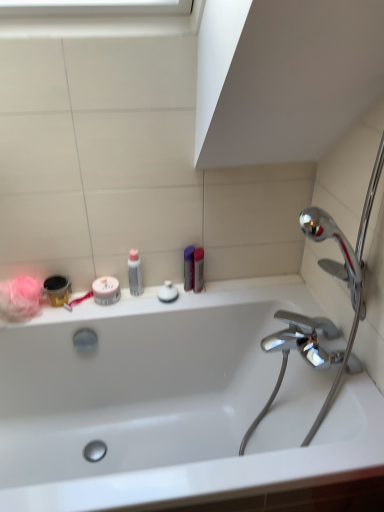
Locate an element on the screen. The image size is (384, 512). white matte jar at center, marked as the first mouthwash in a left-to-right arrangement is located at coordinates (106, 290).

I want to click on metallic silver mouthwash at right, acting as the 2th mouthwash starting from the left, so click(x=198, y=269).

This screenshot has width=384, height=512. What do you see at coordinates (198, 269) in the screenshot?
I see `metallic silver mouthwash at right, marked as the first mouthwash in a right-to-left arrangement` at bounding box center [198, 269].

The image size is (384, 512). Find the location of `white glossy soap at center, placed as the 2th toiletry when sorted from left to right`. white glossy soap at center, placed as the 2th toiletry when sorted from left to right is located at coordinates (168, 292).

Locate an element on the screen. This screenshot has width=384, height=512. white glossy bathtub at center is located at coordinates (172, 403).

Can you confirm if white glossy bathtub at center is bigger than translucent plastic bottle at upper center, which appears as the 3th toiletry when viewed from the right?

Yes.

Is white glossy bathtub at center to the right of translucent plastic bottle at upper center, which appears as the 3th toiletry when viewed from the right, from the viewer's perspective?

Yes.

Is white glossy bathtub at center further to the viewer compared to translucent plastic bottle at upper center, the 1th toiletry positioned from the left?

No, white glossy bathtub at center is in front of translucent plastic bottle at upper center, the 1th toiletry positioned from the left.

Where is `the 2nd toiletry counting from the right side of the white glossy bathtub at center`? The image size is (384, 512). the 2nd toiletry counting from the right side of the white glossy bathtub at center is located at coordinates (189, 268).

Would you say purple plastic container at upper center, which appears as the 1th toiletry when viewed from the right, is outside white glossy bathtub at center?

Yes.

Is purple plastic container at upper center, which appears as the third toiletry when viewed from the left, smaller than white glossy bathtub at center?

Correct, purple plastic container at upper center, which appears as the third toiletry when viewed from the left, occupies less space than white glossy bathtub at center.

How distant is purple plastic container at upper center, which appears as the 1th toiletry when viewed from the right, from white glossy bathtub at center?

purple plastic container at upper center, which appears as the 1th toiletry when viewed from the right, and white glossy bathtub at center are 19.05 inches apart.

Is white matte jar at center, which ranks as the 2th mouthwash in right-to-left order, positioned beyond the bounds of white glossy soap at center, placed as the 2th toiletry when sorted from left to right?

Absolutely, white matte jar at center, which ranks as the 2th mouthwash in right-to-left order, is external to white glossy soap at center, placed as the 2th toiletry when sorted from left to right.

From a real-world perspective, does white matte jar at center, which ranks as the 2th mouthwash in right-to-left order, sit lower than white glossy soap at center, the second toiletry positioned from the right?

No, from a real-world perspective, white matte jar at center, which ranks as the 2th mouthwash in right-to-left order, is not beneath white glossy soap at center, the second toiletry positioned from the right.

Which object is positioned more to the left, white matte jar at center, marked as the first mouthwash in a left-to-right arrangement, or white glossy soap at center, placed as the 2th toiletry when sorted from left to right?

Positioned to the left is white matte jar at center, marked as the first mouthwash in a left-to-right arrangement.

Considering the relative sizes of translucent plastic bottle at upper center, which appears as the 3th toiletry when viewed from the right, and purple plastic container at upper center, which appears as the third toiletry when viewed from the left, in the image provided, is translucent plastic bottle at upper center, which appears as the 3th toiletry when viewed from the right, shorter than purple plastic container at upper center, which appears as the third toiletry when viewed from the left,?

Incorrect, the height of translucent plastic bottle at upper center, which appears as the 3th toiletry when viewed from the right, does not fall short of that of purple plastic container at upper center, which appears as the third toiletry when viewed from the left.

Measure the distance from translucent plastic bottle at upper center, the 1th toiletry positioned from the left, to purple plastic container at upper center, which appears as the third toiletry when viewed from the left.

translucent plastic bottle at upper center, the 1th toiletry positioned from the left, and purple plastic container at upper center, which appears as the third toiletry when viewed from the left, are 7.22 inches apart.

Would you say translucent plastic bottle at upper center, which appears as the 3th toiletry when viewed from the right, is outside purple plastic container at upper center, which appears as the 1th toiletry when viewed from the right?

Yes, translucent plastic bottle at upper center, which appears as the 3th toiletry when viewed from the right, is located beyond the bounds of purple plastic container at upper center, which appears as the 1th toiletry when viewed from the right.

Is translucent plastic bottle at upper center, which appears as the 3th toiletry when viewed from the right, aimed at purple plastic container at upper center, which appears as the 1th toiletry when viewed from the right?

No, translucent plastic bottle at upper center, which appears as the 3th toiletry when viewed from the right, is not facing towards purple plastic container at upper center, which appears as the 1th toiletry when viewed from the right.

Which of these two, metallic silver toothbrush at left or white glossy bathtub at center, is smaller?

metallic silver toothbrush at left is smaller.

Is metallic silver toothbrush at left not near white glossy bathtub at center?

No, there isn't a large distance between metallic silver toothbrush at left and white glossy bathtub at center.

From a real-world perspective, is metallic silver toothbrush at left below white glossy bathtub at center?

No.

The width and height of the screenshot is (384, 512). Identify the location of bathtub to the right of metallic silver toothbrush at left. (172, 403).

Are white matte jar at center, which ranks as the 2th mouthwash in right-to-left order, and white glossy bathtub at center far apart?

They are positioned close to each other.

Considering the positions of objects white matte jar at center, marked as the first mouthwash in a left-to-right arrangement, and white glossy bathtub at center in the image provided, who is more to the right, white matte jar at center, marked as the first mouthwash in a left-to-right arrangement, or white glossy bathtub at center?

white glossy bathtub at center is more to the right.

This screenshot has height=512, width=384. Find the location of `mouthwash that is the 1st one above the white glossy bathtub at center (from a real-world perspective)`. mouthwash that is the 1st one above the white glossy bathtub at center (from a real-world perspective) is located at coordinates (106, 290).

Considering the sizes of white matte jar at center, marked as the first mouthwash in a left-to-right arrangement, and white glossy bathtub at center in the image, is white matte jar at center, marked as the first mouthwash in a left-to-right arrangement, bigger or smaller than white glossy bathtub at center?

Clearly, white matte jar at center, marked as the first mouthwash in a left-to-right arrangement, is smaller in size than white glossy bathtub at center.

Which object is positioned more to the right, metallic silver mouthwash at right, acting as the 2th mouthwash starting from the left, or white glossy bathtub at center?

From the viewer's perspective, metallic silver mouthwash at right, acting as the 2th mouthwash starting from the left, appears more on the right side.

Is metallic silver mouthwash at right, acting as the 2th mouthwash starting from the left, directly adjacent to white glossy bathtub at center?

There is a gap between metallic silver mouthwash at right, acting as the 2th mouthwash starting from the left, and white glossy bathtub at center.

Who is smaller, metallic silver mouthwash at right, acting as the 2th mouthwash starting from the left, or white glossy bathtub at center?

Smaller between the two is metallic silver mouthwash at right, acting as the 2th mouthwash starting from the left.

From the image's perspective, starting from the white glossy bathtub at center, which toiletry is the 2nd one above? Please provide its 2D coordinates.

[(135, 273)]

Locate an element on the screen. This screenshot has width=384, height=512. the 2nd toiletry positioned above the white glossy bathtub at center (from a real-world perspective) is located at coordinates (189, 268).

Based on their spatial positions, is metallic silver toothbrush at left or purple plastic container at upper center, which appears as the 1th toiletry when viewed from the right, closer to metallic silver mouthwash at right, marked as the first mouthwash in a right-to-left arrangement?

Among the two, purple plastic container at upper center, which appears as the 1th toiletry when viewed from the right, is located nearer to metallic silver mouthwash at right, marked as the first mouthwash in a right-to-left arrangement.

Considering their positions, is white matte jar at center, which ranks as the 2th mouthwash in right-to-left order, positioned further to purple plastic container at upper center, which appears as the third toiletry when viewed from the left, than white glossy soap at center, the second toiletry positioned from the right?

white matte jar at center, which ranks as the 2th mouthwash in right-to-left order, is positioned further to the anchor purple plastic container at upper center, which appears as the third toiletry when viewed from the left.

Looking at the image, which one is located further to metallic silver mouthwash at right, acting as the 2th mouthwash starting from the left, metallic silver toothbrush at left or translucent plastic bottle at upper center, which appears as the 3th toiletry when viewed from the right?

metallic silver toothbrush at left is positioned further to the anchor metallic silver mouthwash at right, acting as the 2th mouthwash starting from the left.

From the image, which object appears to be farther from white glossy bathtub at center, purple plastic container at upper center, which appears as the 1th toiletry when viewed from the right, or metallic silver mouthwash at right, acting as the 2th mouthwash starting from the left?

metallic silver mouthwash at right, acting as the 2th mouthwash starting from the left, is further to white glossy bathtub at center.

When comparing their distances from white matte jar at center, which ranks as the 2th mouthwash in right-to-left order, does metallic silver mouthwash at right, marked as the first mouthwash in a right-to-left arrangement, or metallic silver toothbrush at left seem further?

metallic silver mouthwash at right, marked as the first mouthwash in a right-to-left arrangement.

Based on their spatial positions, is translucent plastic bottle at upper center, which appears as the 3th toiletry when viewed from the right, or white matte jar at center, which ranks as the 2th mouthwash in right-to-left order, closer to purple plastic container at upper center, which appears as the third toiletry when viewed from the left?

translucent plastic bottle at upper center, which appears as the 3th toiletry when viewed from the right, is positioned closer to the anchor purple plastic container at upper center, which appears as the third toiletry when viewed from the left.

Considering their positions, is white glossy bathtub at center positioned closer to metallic silver toothbrush at left than white matte jar at center, which ranks as the 2th mouthwash in right-to-left order?

white matte jar at center, which ranks as the 2th mouthwash in right-to-left order, is closer to metallic silver toothbrush at left.

Estimate the real-world distances between objects in this image. Which object is further from white glossy bathtub at center, metallic silver toothbrush at left or purple plastic container at upper center, which appears as the 1th toiletry when viewed from the right?

metallic silver toothbrush at left.

Identify the location of toiletry located between white glossy soap at center, the second toiletry positioned from the right, and metallic silver mouthwash at right, marked as the first mouthwash in a right-to-left arrangement, in the left-right direction. The width and height of the screenshot is (384, 512). (189, 268).

Locate an element on the screen. toiletry between white matte jar at center, marked as the first mouthwash in a left-to-right arrangement, and white glossy soap at center, placed as the 2th toiletry when sorted from left to right is located at coordinates (135, 273).

Locate an element on the screen. This screenshot has width=384, height=512. toothbrush between white glossy bathtub at center and purple plastic container at upper center, which appears as the 1th toiletry when viewed from the right, in the front-back direction is located at coordinates (77, 301).

Where is `toiletry between white glossy bathtub at center and metallic silver toothbrush at left along the z-axis`? The height and width of the screenshot is (512, 384). toiletry between white glossy bathtub at center and metallic silver toothbrush at left along the z-axis is located at coordinates (135, 273).